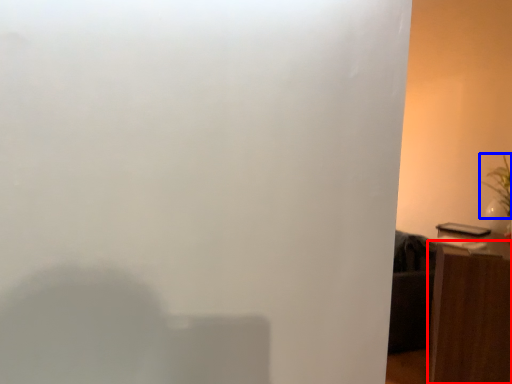
Question: Which object appears closest to the camera in this image, furniture (highlighted by a red box) or plant (highlighted by a blue box)?

Choices:
 (A) furniture
 (B) plant

Answer: (A)